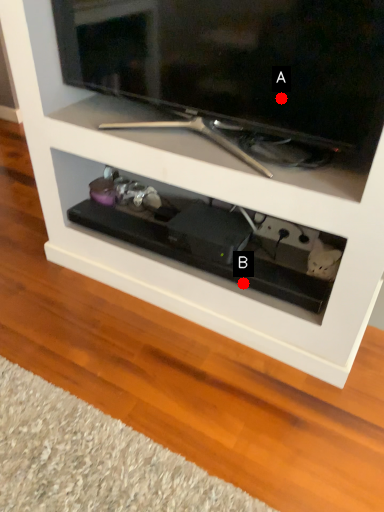
Question: Two points are circled on the image, labeled by A and B beside each circle. Which point appears farthest from the camera in this image?

Choices:
 (A) A is further
 (B) B is further

Answer: (B)